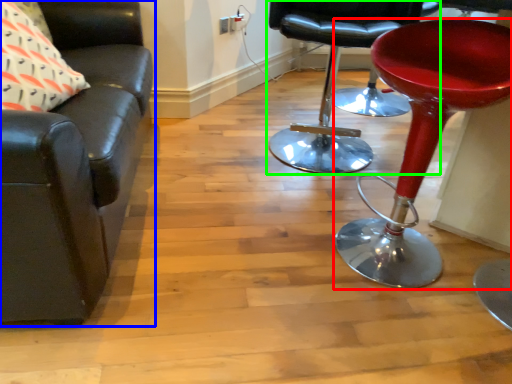
Question: Which object is positioned closest to stool (highlighted by a red box)? Select from chair (highlighted by a blue box) and chair (highlighted by a green box).

Choices:
 (A) chair
 (B) chair

Answer: (B)